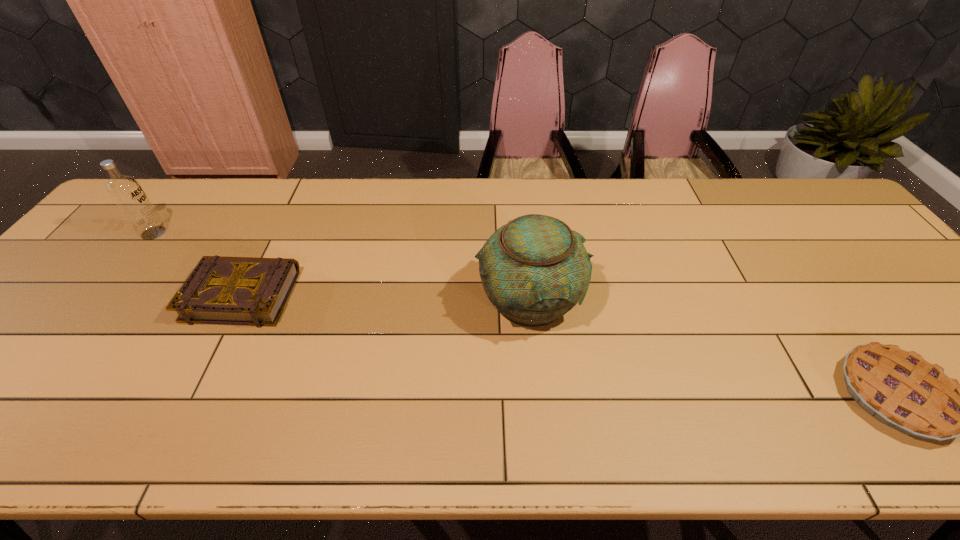
The width and height of the screenshot is (960, 540). In order to click on vodka in this screenshot , I will do `click(126, 192)`.

Locate an element on the screen. the leftmost object is located at coordinates tap(126, 192).

At what (x,y) coordinates should I click in order to perform the action: click on pottery. Please return your answer as a coordinate pair (x, y). The width and height of the screenshot is (960, 540). Looking at the image, I should click on (534, 269).

Find the location of a particular element. the third tallest object is located at coordinates (251, 291).

Image resolution: width=960 pixels, height=540 pixels. In order to click on the second object from left to right in this screenshot , I will do `click(251, 291)`.

You are a GUI agent. You are given a task and a screenshot of the screen. Output one action in this format:
    pyautogui.click(x=<x>, y=<y>)
    Task: Click on the free space located 0.400m on the front label of the vodka
    The width and height of the screenshot is (960, 540).
    Given the screenshot: What is the action you would take?
    coord(302,233)

In order to click on free location located on the back of the second object from right to left in this screenshot , I will do `click(519, 211)`.

At what (x,y) coordinates should I click in order to perform the action: click on vacant space situated 0.330m on the right of the third object from right to left. Please return your answer as a coordinate pair (x, y). The image size is (960, 540). Looking at the image, I should click on (420, 295).

You are a GUI agent. You are given a task and a screenshot of the screen. Output one action in this format:
    pyautogui.click(x=<x>, y=<y>)
    Task: Click on the object present at the left edge
    This screenshot has width=960, height=540.
    Given the screenshot: What is the action you would take?
    pyautogui.click(x=126, y=192)

Locate an element on the screen. Image resolution: width=960 pixels, height=540 pixels. free space at the far edge of the desktop is located at coordinates (225, 214).